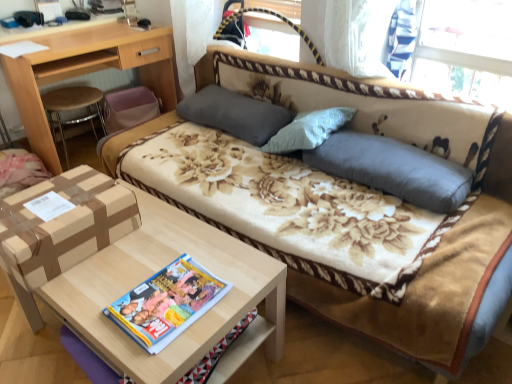
The image size is (512, 384). Find the location of `spots to the right of multicolored glossy magazine at center`. spots to the right of multicolored glossy magazine at center is located at coordinates (234, 290).